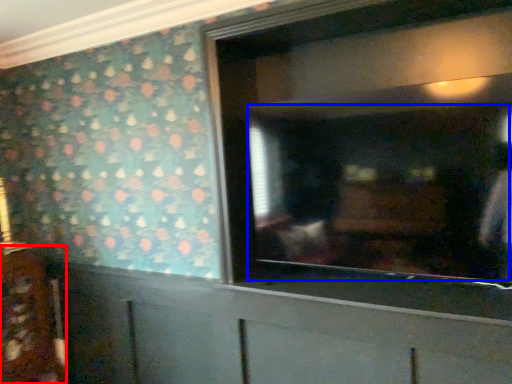
Question: Which object is further to the camera taking this photo, cabinetry (highlighted by a red box) or mirror (highlighted by a blue box)?

Choices:
 (A) cabinetry
 (B) mirror

Answer: (A)